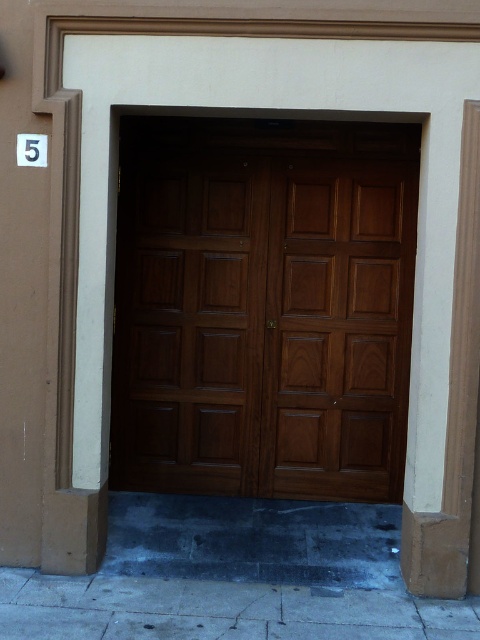
Question: Can you confirm if polished wood double doors at center is thinner than gray concrete pavement at lower center?

Choices:
 (A) yes
 (B) no

Answer: (A)

Question: Which of these objects is positioned closest to the gray concrete pavement at lower center?

Choices:
 (A) polished wood double doors at center
 (B) smooth beige pillar at right
 (C) polished wood door at center

Answer: (B)

Question: Which object is closer to the camera taking this photo?

Choices:
 (A) smooth beige pillar at right
 (B) wooden door at center

Answer: (A)

Question: Is polished wood double doors at center closer to camera compared to polished wood door at center?

Choices:
 (A) no
 (B) yes

Answer: (B)

Question: Is wooden door at center bigger than polished wood door at center?

Choices:
 (A) no
 (B) yes

Answer: (B)

Question: Which point is farther to the camera?

Choices:
 (A) smooth beige pillar at right
 (B) wooden door at center
 (C) polished wood double doors at center
 (D) gray concrete pavement at lower center

Answer: (B)